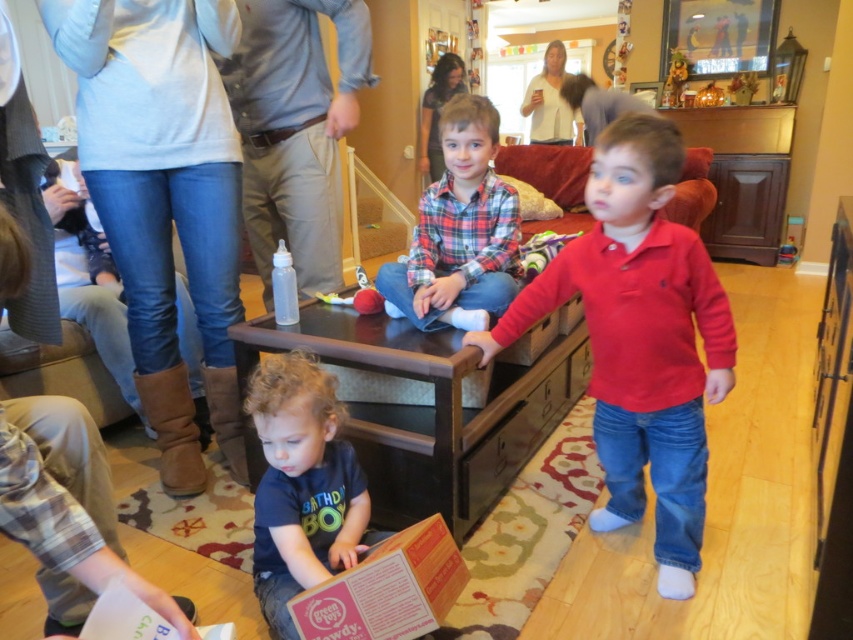
Question: Can you confirm if red cotton shirt at center is positioned to the right of wooden drawer at center?

Choices:
 (A) no
 (B) yes

Answer: (A)

Question: Considering the real-world distances, which object is closest to the red cotton shirt at center?

Choices:
 (A) wooden drawer at center
 (B) plaid fabric shirt at center

Answer: (B)

Question: In this image, where is red cotton shirt at center located relative to dark blue cotton shirt at lower left?

Choices:
 (A) left
 (B) right

Answer: (B)

Question: From the image, what is the correct spatial relationship of dark blue cotton shirt at lower left in relation to orange cardboard box at lower center?

Choices:
 (A) left
 (B) right

Answer: (A)

Question: Considering the real-world distances, which object is closest to the plaid fabric shirt at center?

Choices:
 (A) wooden drawer at center
 (B) dark blue cotton shirt at lower left

Answer: (B)

Question: Which point is farther from the camera taking this photo?

Choices:
 (A) (386, 275)
 (B) (653, 116)
 (C) (306, 609)
 (D) (283, 570)

Answer: (A)